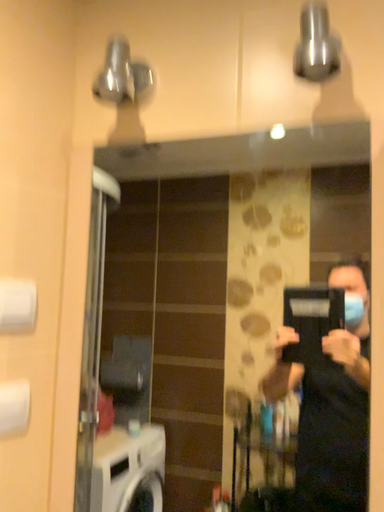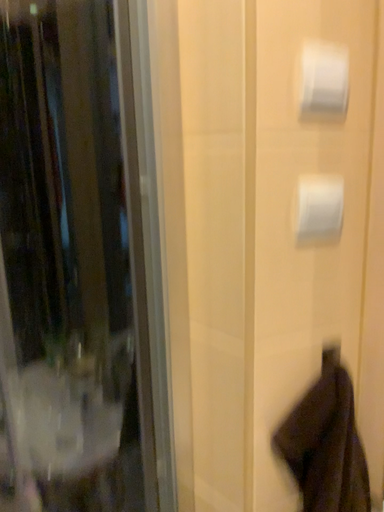
Question: Which way did the camera rotate in the video?

Choices:
 (A) rotated right
 (B) rotated left

Answer: (B)